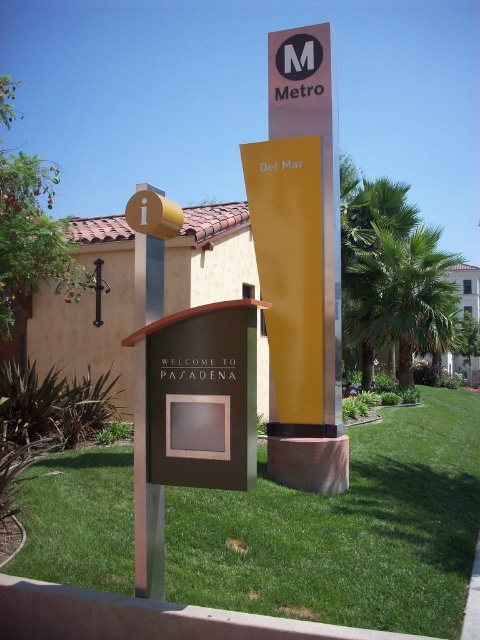
Question: Which object is the closest to the metallic yellow sign at center?

Choices:
 (A) green grass at lower center
 (B) yellow matte sign at upper center

Answer: (B)

Question: From the image, what is the correct spatial relationship of green grass at lower center in relation to metallic yellow sign at center?

Choices:
 (A) right
 (B) left

Answer: (A)

Question: Can you confirm if green grass at lower center is positioned above yellow matte sign at upper center?

Choices:
 (A) yes
 (B) no

Answer: (B)

Question: Which point appears closest to the camera in this image?

Choices:
 (A) (287, 214)
 (B) (338, 308)
 (C) (50, 493)

Answer: (C)

Question: Is yellow matte sign at upper center below metallic yellow sign at center?

Choices:
 (A) no
 (B) yes

Answer: (B)

Question: Considering the real-world distances, which object is farthest from the green grass at lower center?

Choices:
 (A) yellow matte sign at upper center
 (B) metallic yellow sign at center

Answer: (A)